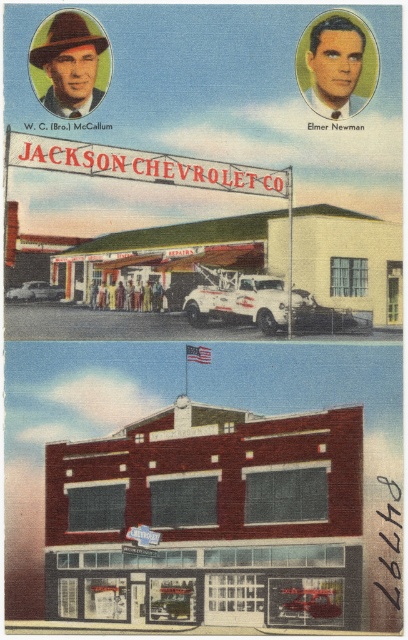
Question: Considering the real-world distances, which object is closest to the matte brown hat at upper left?

Choices:
 (A) brick building at center
 (B) smooth skin face at upper right

Answer: (B)

Question: Does matte brown hat at upper left come in front of smooth skin face at upper right?

Choices:
 (A) yes
 (B) no

Answer: (B)

Question: Is brick building at center below smooth skin face at upper right?

Choices:
 (A) yes
 (B) no

Answer: (A)

Question: Does matte brown hat at upper left appear on the right side of smooth skin face at upper right?

Choices:
 (A) no
 (B) yes

Answer: (A)

Question: Which of the following is the farthest from the observer?

Choices:
 (A) click(x=70, y=596)
 (B) click(x=95, y=35)
 (C) click(x=321, y=60)

Answer: (B)

Question: Which object is positioned farthest from the matte brown hat at upper left?

Choices:
 (A) brick building at center
 (B) smooth skin face at upper right

Answer: (A)